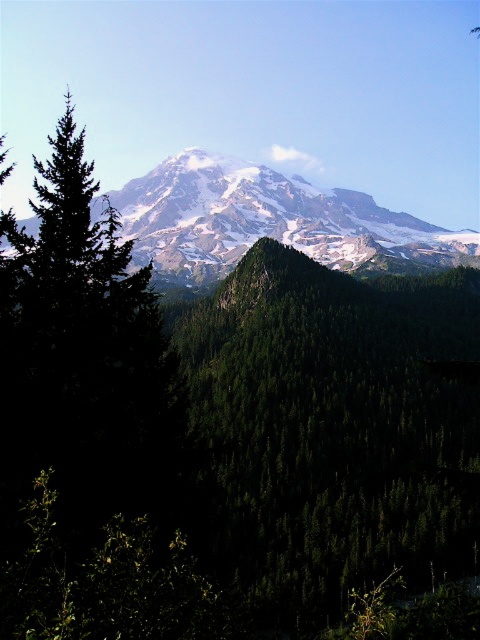
Does green matte tree at center appear on the left side of snowy granite mountain range at upper center?

Incorrect, green matte tree at center is not on the left side of snowy granite mountain range at upper center.

Which is more to the left, green matte tree at center or snowy granite mountain range at upper center?

From the viewer's perspective, snowy granite mountain range at upper center appears more on the left side.

Where is `green matte tree at center`? The width and height of the screenshot is (480, 640). green matte tree at center is located at coordinates (332, 429).